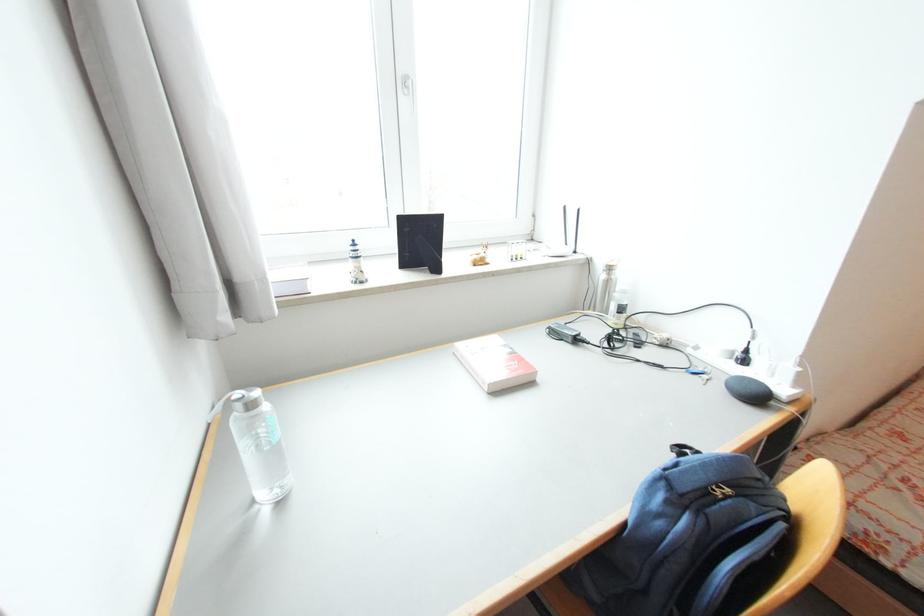
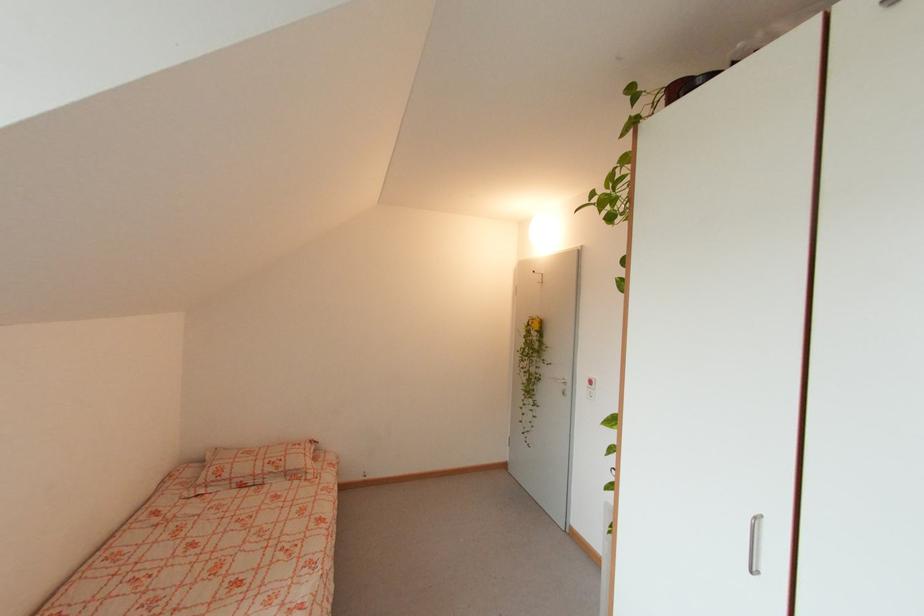
Question: The first image is from the beginning of the video and the second image is from the end. How did the camera likely rotate when shooting the video?

Choices:
 (A) Left
 (B) Right
 (C) Up
 (D) Down

Answer: (B)